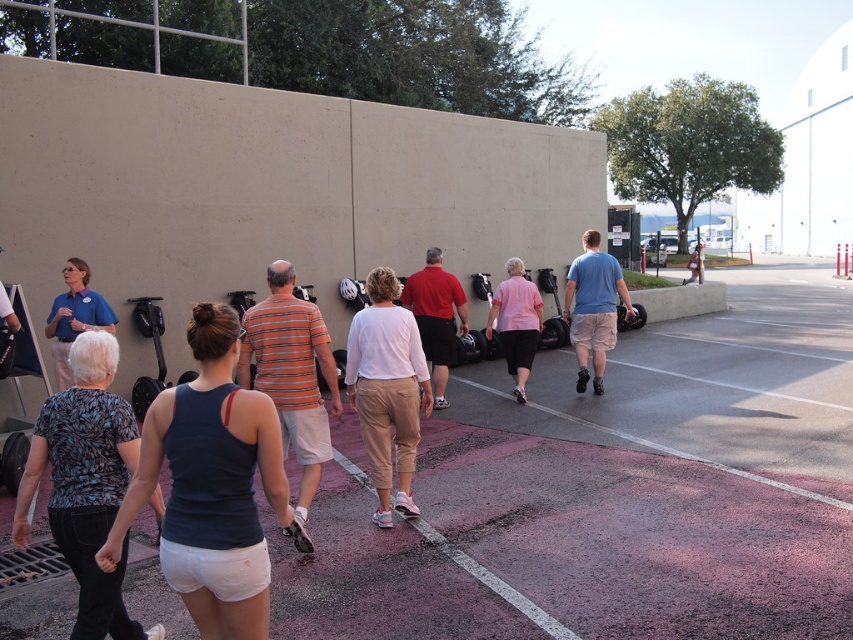
Question: Can you confirm if printed fabric blouse at lower left is wider than matte black helmet at upper center?

Choices:
 (A) no
 (B) yes

Answer: (A)

Question: Which point is farther to the camera?

Choices:
 (A) (538, 326)
 (B) (579, 289)
 (C) (86, 468)
 (D) (659, 451)

Answer: (B)

Question: Can you confirm if red matte shirt at center is bigger than pink matte shirt at center?

Choices:
 (A) no
 (B) yes

Answer: (B)

Question: Which is farther from the pink matte shirt at center?

Choices:
 (A) blue cotton shirt at center
 (B) blue fabric tank top at center
 (C) matte black helmet at upper center

Answer: (C)

Question: Can you confirm if blue fabric tank top at center is positioned to the right of printed fabric blouse at lower left?

Choices:
 (A) yes
 (B) no

Answer: (A)

Question: Which of the following is the farthest from the observer?

Choices:
 (A) blue fabric tank top at center
 (B) light beige cotton pants at center

Answer: (B)